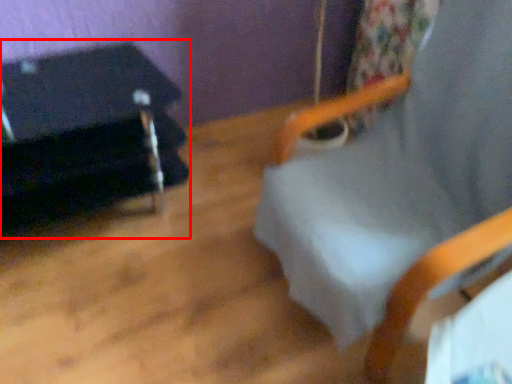
Question: In this image, where is furniture (annotated by the red box) located relative to beach chair?

Choices:
 (A) left
 (B) right

Answer: (A)